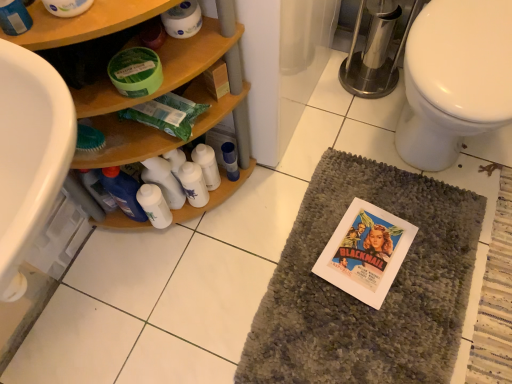
This screenshot has width=512, height=384. I want to click on free space to the right of white glossy bottles at center, the second toiletry in the left-to-right sequence, so click(x=254, y=206).